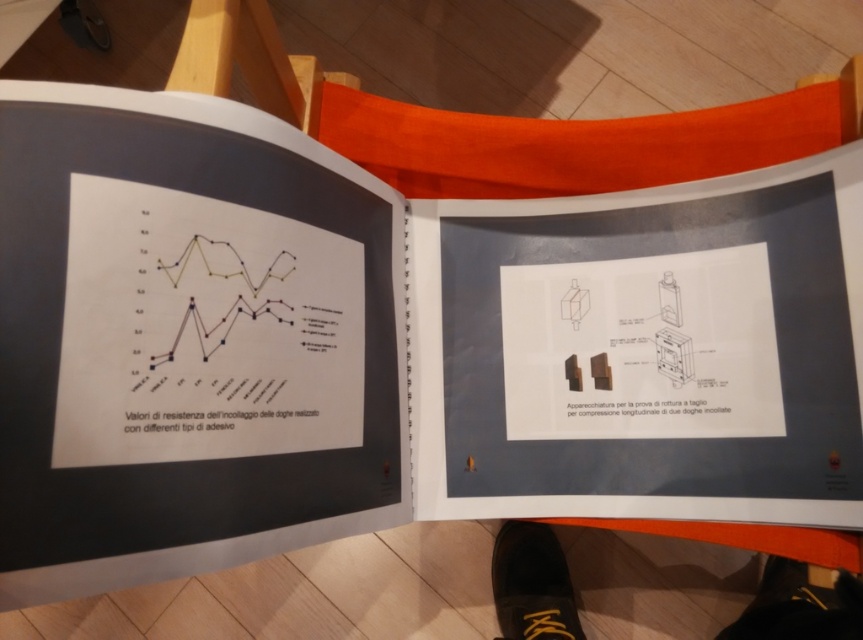
You are a delivery robot that needs to place a package on the wooden surface where the open book is located. However, there are two black leather shoes in the way. Specifically, there is a black leather shoe at lower right and a black leather shoe at lower center. To ensure the package can fit without touching the shoes, what is the minimum distance the robot should maintain between the package and each shoe?

The two black leather shoes are 12.09 inches apart. To avoid touching either shoe, the package must be placed at least half of this distance away from each shoe. Therefore, the minimum distance should be 6.045 inches from each shoe.